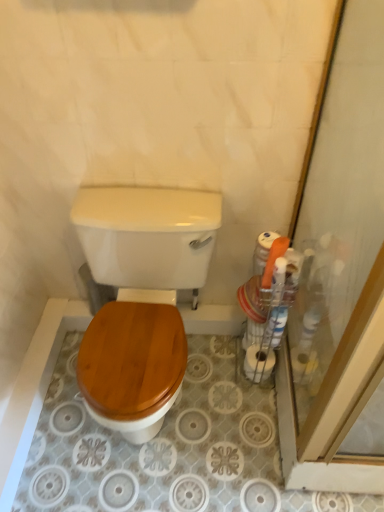
Locate an element on the screen. Image resolution: width=384 pixels, height=512 pixels. white matte toilet paper at right is located at coordinates (258, 362).

Find the location of `wooden toilet seat at center`. wooden toilet seat at center is located at coordinates (148, 240).

Consider the image. Does white matte toilet paper at right have a larger size compared to transparent glass screen door at right?

No.

What's the angular difference between white matte toilet paper at right and transparent glass screen door at right's facing directions?

white matte toilet paper at right and transparent glass screen door at right are facing 92.4 degrees away from each other.

Is white matte toilet paper at right surrounding transparent glass screen door at right?

Actually, transparent glass screen door at right is outside white matte toilet paper at right.

From the image's perspective, between white matte toilet paper at right and transparent glass screen door at right, which one is located above?

transparent glass screen door at right is shown above in the image.

Is transparent glass screen door at right at the back of wooden toilet seat at center?

wooden toilet seat at center is not turned away from transparent glass screen door at right.

Consider the image. From the image's perspective, which object appears higher, wooden toilet seat at center or transparent glass screen door at right?

transparent glass screen door at right, from the image's perspective.

Measure the distance between wooden toilet seat at center and transparent glass screen door at right.

21.38 inches.

Based on the photo, which is closer, (131, 345) or (343, 215)?

Positioned in front is point (343, 215).

Based on the photo, which is in front, white matte toilet paper at right or wooden toilet seat at center?

wooden toilet seat at center is more forward.

From the image's perspective, between white matte toilet paper at right and wooden toilet seat at center, who is located below?

white matte toilet paper at right, from the image's perspective.

Considering the relative sizes of white matte toilet paper at right and wooden toilet seat at center in the image provided, is white matte toilet paper at right thinner than wooden toilet seat at center?

Yes, white matte toilet paper at right is thinner than wooden toilet seat at center.

Considering the relative positions of white matte toilet paper at right and wooden toilet seat at center in the image provided, is white matte toilet paper at right to the left of wooden toilet seat at center from the viewer's perspective?

In fact, white matte toilet paper at right is to the right of wooden toilet seat at center.

From the image's perspective, is wooden toilet seat at center located above or below white matte toilet paper at right?

Based on their image positions, wooden toilet seat at center is located above white matte toilet paper at right.

From a real-world perspective, is wooden toilet seat at center positioned above or below white matte toilet paper at right?

In terms of real-world spatial position, wooden toilet seat at center is above white matte toilet paper at right.

Is wooden toilet seat at center completely or partially outside of white matte toilet paper at right?

Yes, wooden toilet seat at center is outside of white matte toilet paper at right.

Considering the points (182, 260) and (244, 362), which point is behind, point (182, 260) or point (244, 362)?

Point (244, 362)

Which object is positioned more to the right, transparent glass screen door at right or white matte toilet paper at right?

Positioned to the right is transparent glass screen door at right.

Would you consider transparent glass screen door at right to be distant from white matte toilet paper at right?

transparent glass screen door at right is actually quite close to white matte toilet paper at right.

Locate an element on the screen. This screenshot has width=384, height=512. screen door above the white matte toilet paper at right (from a real-world perspective) is located at coordinates 340,278.

From the image's perspective, which one is positioned lower, transparent glass screen door at right or white matte toilet paper at right?

white matte toilet paper at right is shown below in the image.

Between transparent glass screen door at right and wooden toilet seat at center, which one has smaller width?

Thinner between the two is wooden toilet seat at center.

Where is `toilet below the transparent glass screen door at right (from the image's perspective)`? The image size is (384, 512). toilet below the transparent glass screen door at right (from the image's perspective) is located at coordinates (148, 240).

Relative to wooden toilet seat at center, is transparent glass screen door at right in front or behind?

Clearly, transparent glass screen door at right is in front of wooden toilet seat at center.

Where is `toilet paper behind the transparent glass screen door at right`? toilet paper behind the transparent glass screen door at right is located at coordinates (258, 362).

Where is `screen door above the wooden toilet seat at center (from the image's perspective)`? Image resolution: width=384 pixels, height=512 pixels. screen door above the wooden toilet seat at center (from the image's perspective) is located at coordinates (340, 278).

When comparing their distances from wooden toilet seat at center, does white matte toilet paper at right or transparent glass screen door at right seem further?

white matte toilet paper at right lies further to wooden toilet seat at center than the other object.

When comparing their distances from white matte toilet paper at right, does transparent glass screen door at right or wooden toilet seat at center seem further?

Based on the image, wooden toilet seat at center appears to be further to white matte toilet paper at right.

From the image, which object appears to be farther from transparent glass screen door at right, wooden toilet seat at center or white matte toilet paper at right?

Among the two, wooden toilet seat at center is located further to transparent glass screen door at right.

Looking at this image, which object lies further to the anchor point transparent glass screen door at right, white matte toilet paper at right or wooden toilet seat at center?

wooden toilet seat at center is positioned further to the anchor transparent glass screen door at right.

Considering their positions, is wooden toilet seat at center positioned further to white matte toilet paper at right than transparent glass screen door at right?

The object further to white matte toilet paper at right is wooden toilet seat at center.

When comparing their distances from wooden toilet seat at center, does transparent glass screen door at right or white matte toilet paper at right seem further?

The object further to wooden toilet seat at center is white matte toilet paper at right.

Find the location of `toilet positioned between transparent glass screen door at right and white matte toilet paper at right from near to far`. toilet positioned between transparent glass screen door at right and white matte toilet paper at right from near to far is located at coordinates (148, 240).